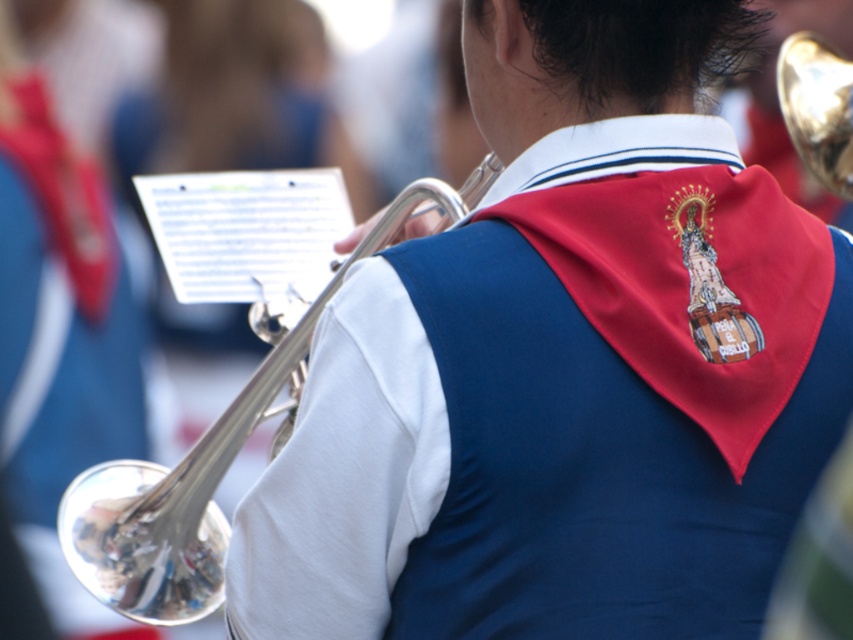
Image resolution: width=853 pixels, height=640 pixels. What do you see at coordinates (345, 474) in the screenshot? I see `metallic blue vest at center` at bounding box center [345, 474].

Can you confirm if metallic blue vest at center is shorter than shiny brass trumpet at upper right?

In fact, metallic blue vest at center may be taller than shiny brass trumpet at upper right.

Who is more forward, (434, 396) or (805, 92)?

Point (434, 396) is in front.

Where is `metallic blue vest at center`? The image size is (853, 640). metallic blue vest at center is located at coordinates (345, 474).

Can you confirm if metallic blue vest at center is positioned to the left of silver polished trumpet at left?

No, metallic blue vest at center is not to the left of silver polished trumpet at left.

Is point (416, 342) farther from camera compared to point (318, 196)?

No.

Between point (386, 552) and point (241, 266), which one is positioned in front?

Point (386, 552)

At what (x,y) coordinates should I click in order to perform the action: click on metallic blue vest at center. Please return your answer as a coordinate pair (x, y). This screenshot has width=853, height=640. Looking at the image, I should click on (345, 474).

Between point (138, 540) and point (782, 65), which one is positioned behind?

Positioned behind is point (782, 65).

Is silver polished trumpet at left bigger than shiny brass trumpet at upper right?

Correct, silver polished trumpet at left is larger in size than shiny brass trumpet at upper right.

What are the coordinates of `silver polished trumpet at left` in the screenshot? It's located at (241, 390).